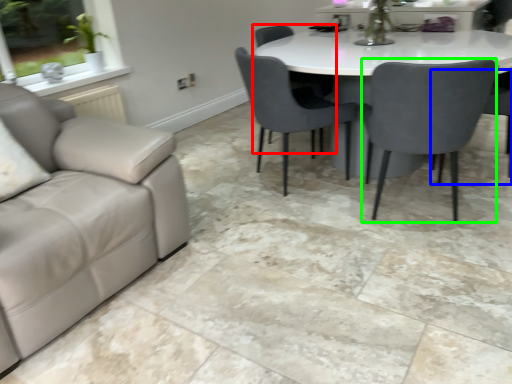
Question: Considering the real-world distances, which object is closest to chair (highlighted by a red box)? chair (highlighted by a blue box) or chair (highlighted by a green box).

Choices:
 (A) chair
 (B) chair

Answer: (B)